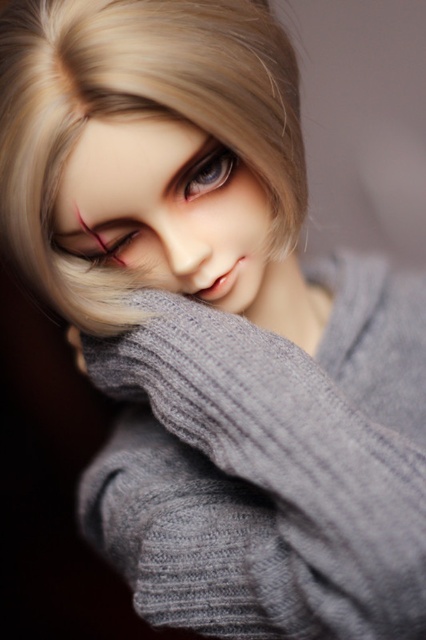
Question: Is blondehair at upper center below matte plastic eye at center?

Choices:
 (A) yes
 (B) no

Answer: (B)

Question: Which object is positioned closest to the matte plastic eye at center?

Choices:
 (A) matte gray doll face at upper center
 (B) matte black eye at center

Answer: (A)

Question: Which is nearer to the blondehair at upper center?

Choices:
 (A) matte black eye at center
 (B) matte gray doll face at upper center
 (C) matte plastic eye at center

Answer: (B)

Question: Among these points, which one is nearest to the camera?

Choices:
 (A) (204, 173)
 (B) (43, 19)
 (C) (135, 236)
 (D) (242, 314)

Answer: (B)

Question: Can you confirm if blondehair at upper center is bigger than matte black eye at center?

Choices:
 (A) yes
 (B) no

Answer: (A)

Question: Where is matte gray doll face at upper center located in relation to matte black eye at center in the image?

Choices:
 (A) left
 (B) right

Answer: (B)